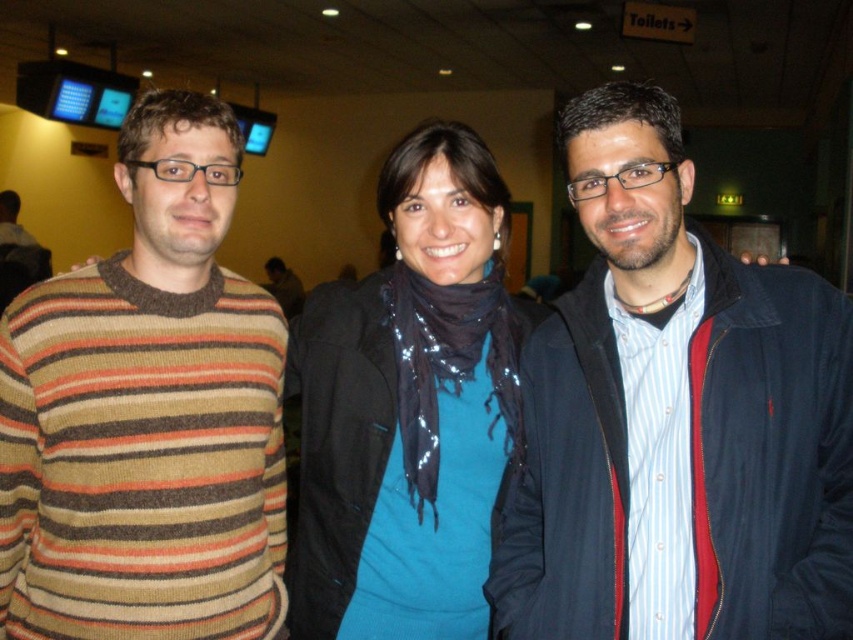
Question: Which of these objects is positioned closest to the striped knit sweater at left?

Choices:
 (A) dark blue jacket at center
 (B) blue sequined scarf at center

Answer: (B)

Question: Which point is closer to the camera taking this photo?

Choices:
 (A) (515, 554)
 (B) (467, 220)

Answer: (A)

Question: Does dark blue jacket at center come in front of striped knit sweater at left?

Choices:
 (A) yes
 (B) no

Answer: (A)

Question: Which object appears farthest from the camera in this image?

Choices:
 (A) dark blue jacket at center
 (B) striped knit sweater at left
 (C) blue sequined scarf at center

Answer: (C)

Question: Can you confirm if striped knit sweater at left is bigger than blue sequined scarf at center?

Choices:
 (A) yes
 (B) no

Answer: (A)

Question: Is dark blue jacket at center thinner than striped knit sweater at left?

Choices:
 (A) no
 (B) yes

Answer: (A)